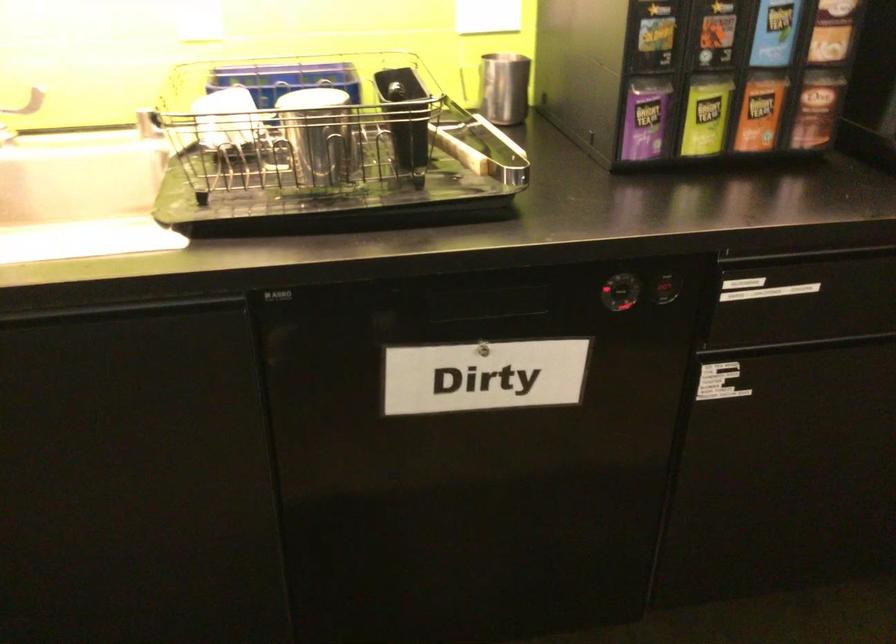
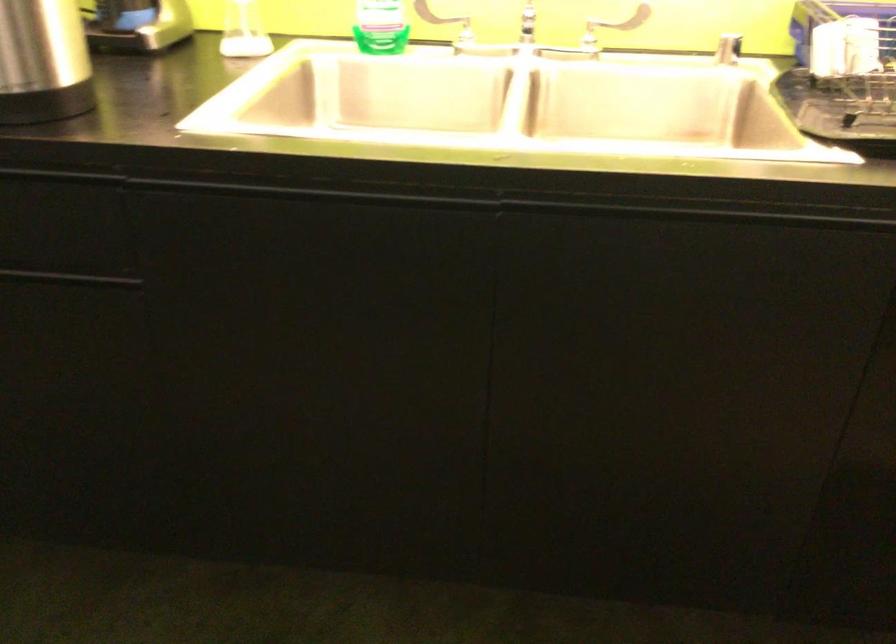
Question: What movement of the cameraman would produce the second image?

Choices:
 (A) Left
 (B) Right
 (C) Forward
 (D) Backward

Answer: (A)